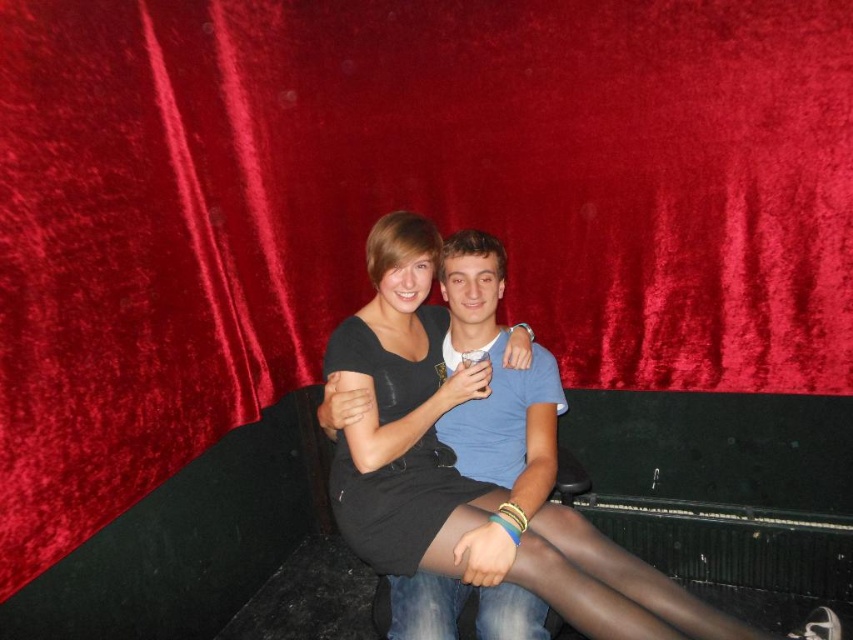
Question: Which object appears closest to the camera in this image?

Choices:
 (A) matte black dress at center
 (B) black matte tights at center
 (C) black matte dress at center

Answer: (B)

Question: Which point is farther to the camera?

Choices:
 (A) matte black dress at center
 (B) black matte dress at center
 (C) black matte tights at center

Answer: (B)

Question: Does black matte dress at center have a lesser width compared to matte black dress at center?

Choices:
 (A) yes
 (B) no

Answer: (A)

Question: Is matte black dress at center bigger than black matte tights at center?

Choices:
 (A) no
 (B) yes

Answer: (B)

Question: Does black matte dress at center appear under black matte tights at center?

Choices:
 (A) no
 (B) yes

Answer: (A)

Question: Which object is the farthest from the black matte dress at center?

Choices:
 (A) matte black dress at center
 (B) black matte tights at center

Answer: (B)